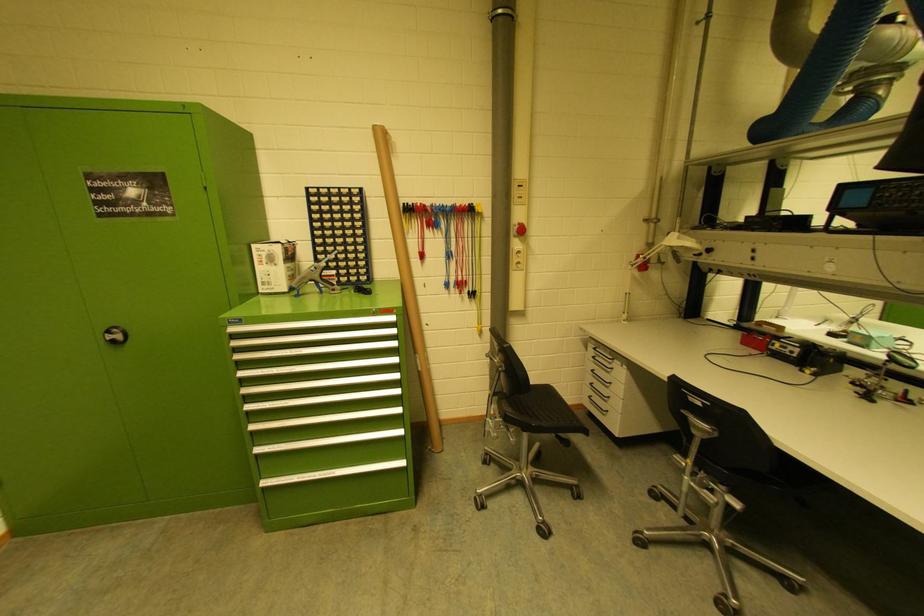
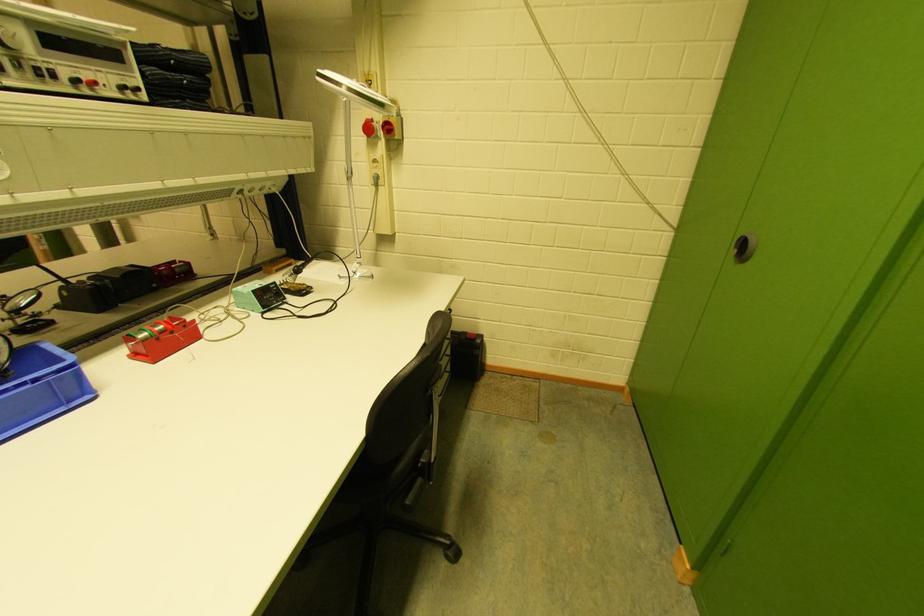
Question: The images are taken continuously from a first-person perspective. In which direction are you moving?

Choices:
 (A) Left
 (B) Right
 (C) Forward
 (D) Backward

Answer: (B)